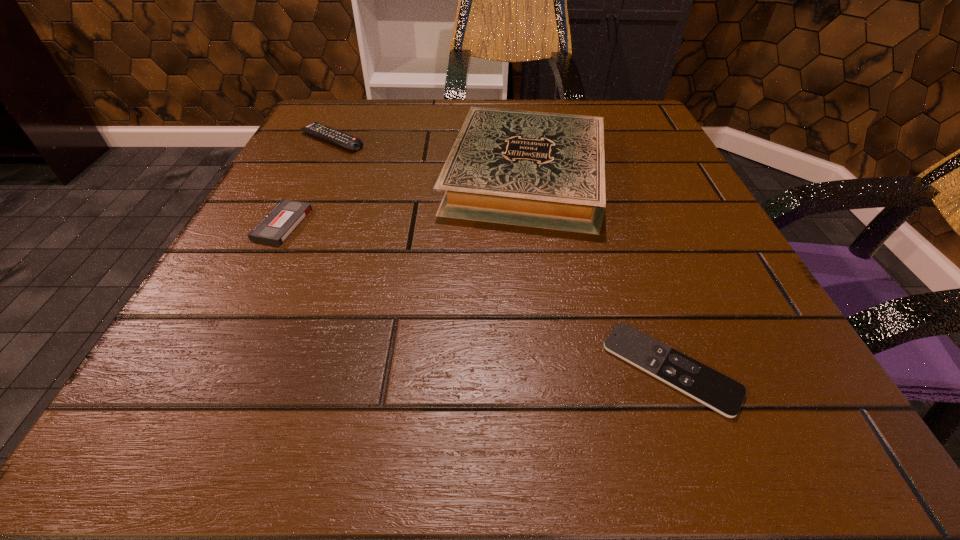
You are a GUI agent. You are given a task and a screenshot of the screen. Output one action in this format:
    pyautogui.click(x=<x>, y=<y>)
    Task: Click on the free space at the far edge of the desktop
    The image size is (960, 540).
    Given the screenshot: What is the action you would take?
    point(446,108)

In the image, there is a desktop. Identify the location of vacant space at the near edge. (527, 395).

You are a GUI agent. You are given a task and a screenshot of the screen. Output one action in this format:
    pyautogui.click(x=<x>, y=<y>)
    Task: Click on the vacant space at the left edge of the desktop
    
    Given the screenshot: What is the action you would take?
    pyautogui.click(x=322, y=172)

Image resolution: width=960 pixels, height=540 pixels. What are the coordinates of `free space at the right edge` in the screenshot? It's located at (676, 347).

At what (x,y) coordinates should I click in order to perform the action: click on blank space at the far left corner of the desktop. Please return your answer as a coordinate pair (x, y). This screenshot has width=960, height=540. Looking at the image, I should click on (377, 141).

Locate an element on the screen. free region at the near left corner of the desktop is located at coordinates (163, 392).

Where is `vacant region at the far right corner of the desktop`? vacant region at the far right corner of the desktop is located at coordinates (666, 145).

The image size is (960, 540). In the image, there is a desktop. In order to click on vacant region at the near right corner in this screenshot , I will do `click(828, 429)`.

The width and height of the screenshot is (960, 540). I want to click on empty location between the second tallest object and the videotape, so coord(307,182).

At what (x,y) coordinates should I click in order to perform the action: click on free point between the hardback book and the second shortest object. Please return your answer as a coordinate pair (x, y). Looking at the image, I should click on pos(404,199).